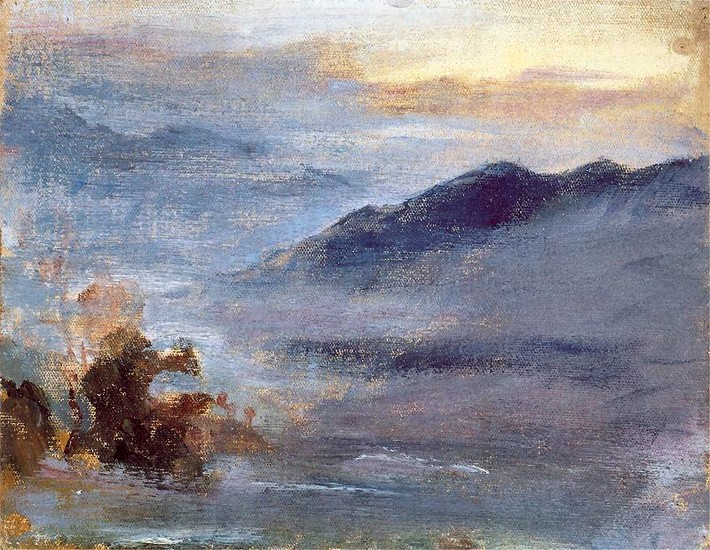
Locate an element on the screen. plant is located at coordinates (248, 417).